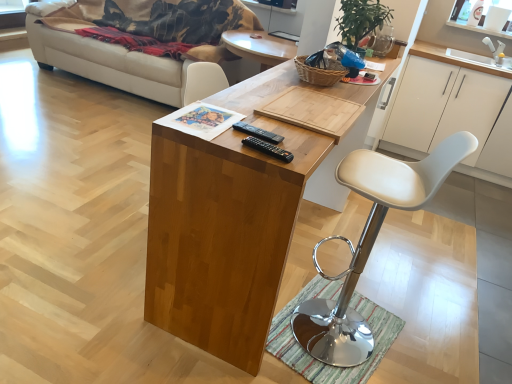
Question: Does point (329, 357) appear closer or farther from the camera than point (187, 54)?

Choices:
 (A) farther
 (B) closer

Answer: (B)

Question: From a real-world perspective, is white leather stool at center above or below beige fabric couch at left?

Choices:
 (A) above
 (B) below

Answer: (A)

Question: Based on their relative distances, which object is nearer to the white leather stool at center?

Choices:
 (A) woven brown basket at upper center
 (B) black plastic remote at center, marked as the second remote in a back-to-front arrangement
 (C) striped fabric mat at lower center
 (D) wooden desk at center
 (E) black plastic remote at center, placed as the first remote when sorted from back to front

Answer: (C)

Question: Based on their relative distances, which object is farther from the striped fabric mat at lower center?

Choices:
 (A) beige fabric couch at left
 (B) wooden desk at center
 (C) white matte cabinet at right
 (D) white leather stool at center
 (E) black plastic remote at center, arranged as the 2th remote when viewed from the front

Answer: (A)